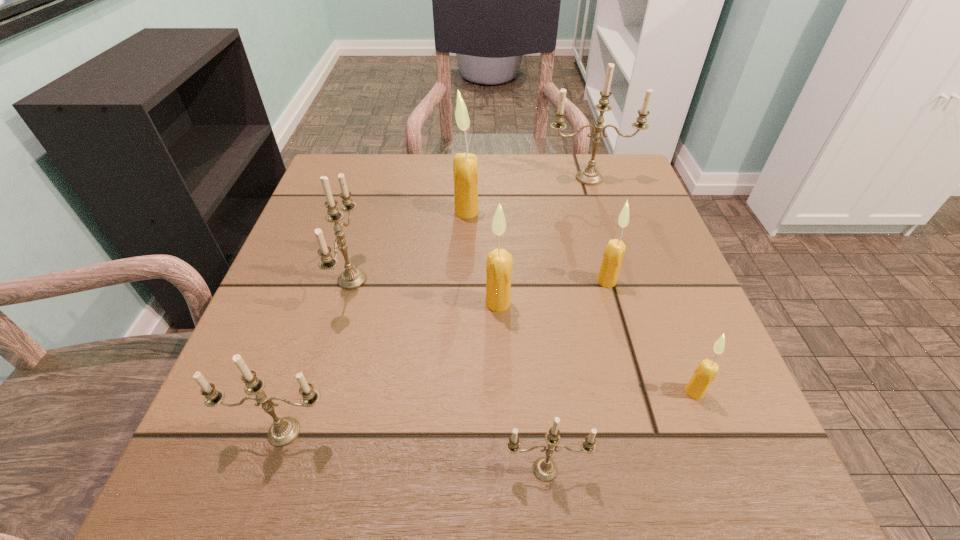
Find the location of a particular element. The height and width of the screenshot is (540, 960). the third farthest metallic candle is located at coordinates (283, 431).

This screenshot has height=540, width=960. What are the coordinates of `the third nearest object` in the screenshot? It's located at (707, 370).

Image resolution: width=960 pixels, height=540 pixels. In order to click on the third nearest candle in this screenshot , I will do [707, 370].

Image resolution: width=960 pixels, height=540 pixels. Find the location of `the third metallic candle from left to right`. the third metallic candle from left to right is located at coordinates tap(545, 469).

At what (x,y) coordinates should I click in order to perform the action: click on the nearest metallic candle. Please return your answer as a coordinate pair (x, y). Looking at the image, I should click on (545, 469).

The height and width of the screenshot is (540, 960). I want to click on vacant area situated on the right of the seventh nearest candle, so click(x=654, y=212).

You are a GUI agent. You are given a task and a screenshot of the screen. Output one action in this format:
    pyautogui.click(x=<x>, y=<y>)
    Task: Click on the vacant space located on the front of the rightmost metallic candle
    The image size is (960, 540).
    Given the screenshot: What is the action you would take?
    pyautogui.click(x=602, y=219)

The height and width of the screenshot is (540, 960). What are the coordinates of `vacant point located 0.270m on the front of the third nearest metallic candle` in the screenshot? It's located at (296, 476).

At what (x,y) coordinates should I click in order to perform the action: click on free space located on the back of the third farthest cream candle. Please return your answer as a coordinate pair (x, y). This screenshot has height=540, width=960. Looking at the image, I should click on (493, 179).

Where is `vacant space located on the back of the third biggest cream candle`? The image size is (960, 540). vacant space located on the back of the third biggest cream candle is located at coordinates (574, 166).